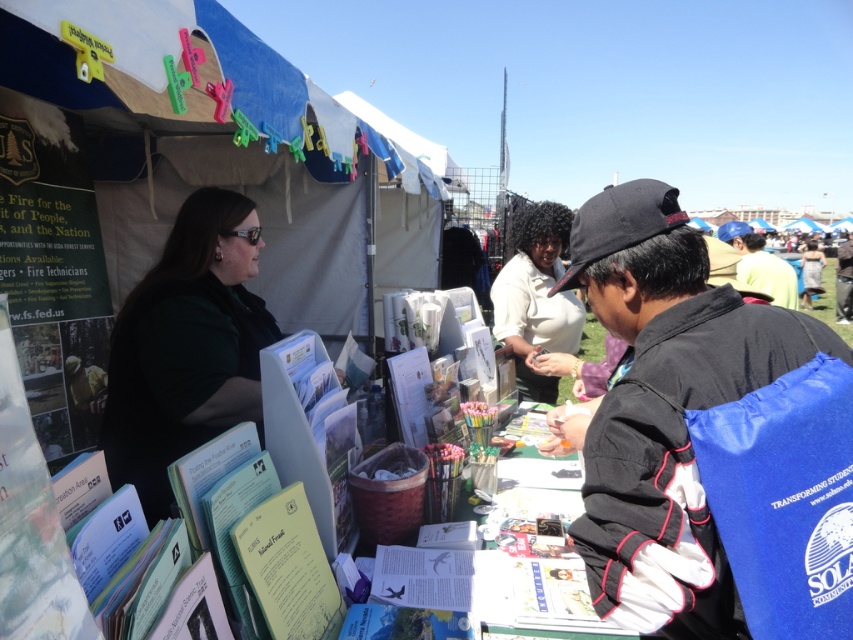
You are at the outdoor event under the tent and see the blue fabric backpack at center and the green fabric dress at center. Which item is positioned lower in the scene?

The blue fabric backpack at center is positioned below the green fabric dress at center, so it is the lower item.

You are organizing a community event and have both the blue fabric backpack at center and the green fabric dress at center available. If you need to choose an item with a larger width for a display, which one should you select?

The green fabric dress at center has a larger width than the blue fabric backpack at center, so you should select the green fabric dress at center for the display.